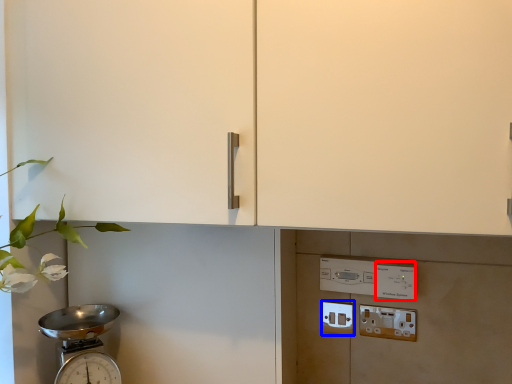
Question: Which object appears closest to the camera in this image, light switch (highlighted by a red box) or electric outlet (highlighted by a blue box)?

Choices:
 (A) light switch
 (B) electric outlet

Answer: (A)